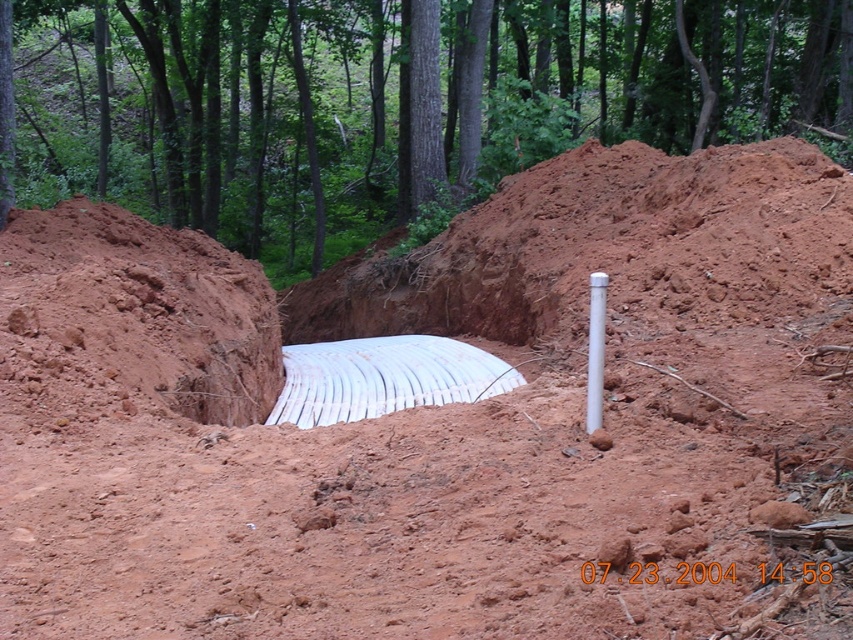
Question: Is reddish-brown clay mound at center-left further to camera compared to white plastic pole at center?

Choices:
 (A) no
 (B) yes

Answer: (B)

Question: Which point is closer to the camera?

Choices:
 (A) white plastic pole at center
 (B) reddish-brown clay mound at center-left

Answer: (A)

Question: Which point is farther to the camera?

Choices:
 (A) reddish-brown clay mound at center-left
 (B) white plastic pole at center

Answer: (A)

Question: Observing the image, what is the correct spatial positioning of reddish-brown clay mound at center-left in reference to white plastic pole at center?

Choices:
 (A) right
 (B) left

Answer: (B)

Question: Is reddish-brown clay mound at center-left closer to camera compared to white plastic pole at center?

Choices:
 (A) no
 (B) yes

Answer: (A)

Question: Which object appears closest to the camera in this image?

Choices:
 (A) reddish-brown clay mound at center-left
 (B) white plastic pole at center

Answer: (B)